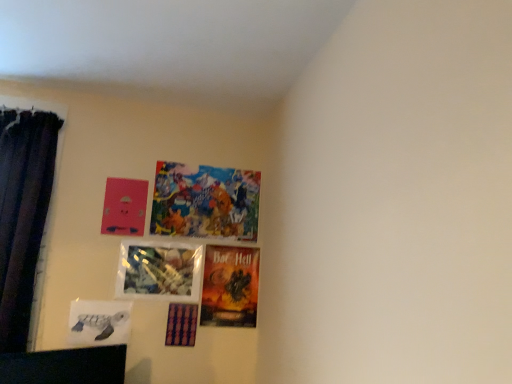
In order to click on dark velvet curtain at left in this screenshot , I will do `click(23, 214)`.

You are a GUI agent. You are given a task and a screenshot of the screen. Output one action in this format:
    pyautogui.click(x=<x>, y=<y>)
    Task: Click on the colorful paper collage at upper center, positioned as the first picture frame in top-to-bottom order
    The height and width of the screenshot is (384, 512).
    Given the screenshot: What is the action you would take?
    click(205, 202)

Between colorful paper collage at upper center, positioned as the first picture frame in top-to-bottom order, and matte cardboard poster at center, which is the 4th picture frame in top-to-bottom order, which one has less height?

colorful paper collage at upper center, positioned as the first picture frame in top-to-bottom order.

From the image's perspective, relative to matte cardboard poster at center, which is the 4th picture frame in top-to-bottom order, is colorful paper collage at upper center, positioned as the first picture frame in top-to-bottom order, above or below?

Clearly, from the image's perspective, colorful paper collage at upper center, positioned as the first picture frame in top-to-bottom order, is above matte cardboard poster at center, which is the 4th picture frame in top-to-bottom order.

Would you say matte cardboard poster at center, which is the 4th picture frame in top-to-bottom order, is part of colorful paper collage at upper center, which ranks as the 6th picture frame in bottom-to-top order,'s contents?

No, matte cardboard poster at center, which is the 4th picture frame in top-to-bottom order, is not surrounded by colorful paper collage at upper center, which ranks as the 6th picture frame in bottom-to-top order.

From the image's perspective, is translucent plastic picture frame at center, the 3th picture frame viewed from the top, positioned above or below matte cardboard poster at center, positioned as the 3th picture frame in bottom-to-top order?

translucent plastic picture frame at center, the 3th picture frame viewed from the top, is situated higher than matte cardboard poster at center, positioned as the 3th picture frame in bottom-to-top order, in the image.

Consider the image. From a real-world perspective, is translucent plastic picture frame at center, arranged as the 4th picture frame when ordered from the bottom, below matte cardboard poster at center, positioned as the 3th picture frame in bottom-to-top order?

No, from a real-world perspective, translucent plastic picture frame at center, arranged as the 4th picture frame when ordered from the bottom, is not beneath matte cardboard poster at center, positioned as the 3th picture frame in bottom-to-top order.

Considering the sizes of objects translucent plastic picture frame at center, the 3th picture frame viewed from the top, and matte cardboard poster at center, which is the 4th picture frame in top-to-bottom order, in the image provided, who is taller, translucent plastic picture frame at center, the 3th picture frame viewed from the top, or matte cardboard poster at center, which is the 4th picture frame in top-to-bottom order,?

matte cardboard poster at center, which is the 4th picture frame in top-to-bottom order.

Measure the distance from purple glossy picture frame at lower center, which is the 1th picture frame in bottom-to-top order, to translucent plastic picture frame at center, the 3th picture frame viewed from the top.

The distance of purple glossy picture frame at lower center, which is the 1th picture frame in bottom-to-top order, from translucent plastic picture frame at center, the 3th picture frame viewed from the top, is 7.83 inches.

Is purple glossy picture frame at lower center, which is the 1th picture frame in bottom-to-top order, touching translucent plastic picture frame at center, the 3th picture frame viewed from the top?

No, purple glossy picture frame at lower center, which is the 1th picture frame in bottom-to-top order, is not in contact with translucent plastic picture frame at center, the 3th picture frame viewed from the top.

Which of these two, purple glossy picture frame at lower center, which is counted as the 6th picture frame, starting from the top, or translucent plastic picture frame at center, arranged as the 4th picture frame when ordered from the bottom, stands shorter?

purple glossy picture frame at lower center, which is counted as the 6th picture frame, starting from the top, is shorter.

Is purple glossy picture frame at lower center, which is counted as the 6th picture frame, starting from the top, wider or thinner than translucent plastic picture frame at center, arranged as the 4th picture frame when ordered from the bottom?

In the image, purple glossy picture frame at lower center, which is counted as the 6th picture frame, starting from the top, appears to be wider than translucent plastic picture frame at center, arranged as the 4th picture frame when ordered from the bottom.

Considering the relative positions of matte cardboard poster at center, positioned as the 3th picture frame in bottom-to-top order, and matte pink picture frame at upper left, acting as the second picture frame starting from the top, in the image provided, is matte cardboard poster at center, positioned as the 3th picture frame in bottom-to-top order, to the left or to the right of matte pink picture frame at upper left, acting as the second picture frame starting from the top,?

matte cardboard poster at center, positioned as the 3th picture frame in bottom-to-top order, is to the right of matte pink picture frame at upper left, acting as the second picture frame starting from the top.

I want to click on the 2nd picture frame positioned above the matte cardboard poster at center, which is the 4th picture frame in top-to-bottom order (from the image's perspective), so click(x=124, y=207).

Is matte cardboard poster at center, positioned as the 3th picture frame in bottom-to-top order, positioned with its back to matte pink picture frame at upper left, placed as the fifth picture frame when sorted from bottom to top?

matte cardboard poster at center, positioned as the 3th picture frame in bottom-to-top order, is not turned away from matte pink picture frame at upper left, placed as the fifth picture frame when sorted from bottom to top.

Is colorful paper collage at upper center, positioned as the first picture frame in top-to-bottom order, in front of translucent plastic picture frame at center, the 3th picture frame viewed from the top?

No, colorful paper collage at upper center, positioned as the first picture frame in top-to-bottom order, is further to the viewer.

Does colorful paper collage at upper center, positioned as the first picture frame in top-to-bottom order, turn towards translucent plastic picture frame at center, arranged as the 4th picture frame when ordered from the bottom?

No, colorful paper collage at upper center, positioned as the first picture frame in top-to-bottom order, is not turned towards translucent plastic picture frame at center, arranged as the 4th picture frame when ordered from the bottom.

Is colorful paper collage at upper center, positioned as the first picture frame in top-to-bottom order, outside of translucent plastic picture frame at center, the 3th picture frame viewed from the top?

Indeed, colorful paper collage at upper center, positioned as the first picture frame in top-to-bottom order, is completely outside translucent plastic picture frame at center, the 3th picture frame viewed from the top.

How different are the orientations of colorful paper collage at upper center, which ranks as the 6th picture frame in bottom-to-top order, and translucent plastic picture frame at center, arranged as the 4th picture frame when ordered from the bottom, in degrees?

colorful paper collage at upper center, which ranks as the 6th picture frame in bottom-to-top order, and translucent plastic picture frame at center, arranged as the 4th picture frame when ordered from the bottom, are facing 0.026 degrees away from each other.

Considering the positions of point (209, 247) and point (186, 327), is point (209, 247) closer or farther from the camera than point (186, 327)?

Point (209, 247).

Looking at this image, is matte cardboard poster at center, positioned as the 3th picture frame in bottom-to-top order, positioned with its back to purple glossy picture frame at lower center, which is the 1th picture frame in bottom-to-top order?

No, matte cardboard poster at center, positioned as the 3th picture frame in bottom-to-top order, is not facing the opposite direction of purple glossy picture frame at lower center, which is the 1th picture frame in bottom-to-top order.

Starting from the matte cardboard poster at center, which is the 4th picture frame in top-to-bottom order, which picture frame is the 2nd one to the left? Please provide its 2D coordinates.

[(181, 324)]

Is colorful paper collage at upper center, which ranks as the 6th picture frame in bottom-to-top order, inside the boundaries of purple glossy picture frame at lower center, which is the 1th picture frame in bottom-to-top order, or outside?

colorful paper collage at upper center, which ranks as the 6th picture frame in bottom-to-top order, lies outside purple glossy picture frame at lower center, which is the 1th picture frame in bottom-to-top order.

Which is more to the left, colorful paper collage at upper center, positioned as the first picture frame in top-to-bottom order, or purple glossy picture frame at lower center, which is counted as the 6th picture frame, starting from the top?

purple glossy picture frame at lower center, which is counted as the 6th picture frame, starting from the top.

Who is shorter, colorful paper collage at upper center, positioned as the first picture frame in top-to-bottom order, or purple glossy picture frame at lower center, which is the 1th picture frame in bottom-to-top order?

Standing shorter between the two is purple glossy picture frame at lower center, which is the 1th picture frame in bottom-to-top order.

At what (x,y) coordinates should I click in order to perform the action: click on picture frame on the right side of colorful paper collage at upper center, which ranks as the 6th picture frame in bottom-to-top order. Please return your answer as a coordinate pair (x, y). Looking at the image, I should click on (230, 286).

Where is `picture frame that is the 1st one when counting upward from the matte cardboard poster at center, positioned as the 3th picture frame in bottom-to-top order (from the image's perspective)`? picture frame that is the 1st one when counting upward from the matte cardboard poster at center, positioned as the 3th picture frame in bottom-to-top order (from the image's perspective) is located at coordinates (159, 271).

Looking at the image, which one is located closer to translucent plastic picture frame at center, the 3th picture frame viewed from the top, colorful paper collage at upper center, which ranks as the 6th picture frame in bottom-to-top order, or dark velvet curtain at left?

Among the two, colorful paper collage at upper center, which ranks as the 6th picture frame in bottom-to-top order, is located nearer to translucent plastic picture frame at center, the 3th picture frame viewed from the top.

Looking at the image, which one is located further to matte cardboard poster at center, which is the 4th picture frame in top-to-bottom order, matte white turtle at lower left, which ranks as the second picture frame in bottom-to-top order, or dark velvet curtain at left?

dark velvet curtain at left lies further to matte cardboard poster at center, which is the 4th picture frame in top-to-bottom order, than the other object.

From the picture: Looking at the image, which one is located further to dark velvet curtain at left, matte white turtle at lower left, which ranks as the second picture frame in bottom-to-top order, or matte cardboard poster at center, positioned as the 3th picture frame in bottom-to-top order?

Based on the image, matte cardboard poster at center, positioned as the 3th picture frame in bottom-to-top order, appears to be further to dark velvet curtain at left.

Considering their positions, is matte cardboard poster at center, positioned as the 3th picture frame in bottom-to-top order, positioned closer to dark velvet curtain at left than matte pink picture frame at upper left, placed as the fifth picture frame when sorted from bottom to top?

matte pink picture frame at upper left, placed as the fifth picture frame when sorted from bottom to top, lies closer to dark velvet curtain at left than the other object.

Estimate the real-world distances between objects in this image. Which object is further from purple glossy picture frame at lower center, which is the 1th picture frame in bottom-to-top order, matte pink picture frame at upper left, acting as the second picture frame starting from the top, or matte cardboard poster at center, which is the 4th picture frame in top-to-bottom order?

matte pink picture frame at upper left, acting as the second picture frame starting from the top, is positioned further to the anchor purple glossy picture frame at lower center, which is the 1th picture frame in bottom-to-top order.

Which object lies nearer to the anchor point matte cardboard poster at center, positioned as the 3th picture frame in bottom-to-top order, translucent plastic picture frame at center, the 3th picture frame viewed from the top, or dark velvet curtain at left?

translucent plastic picture frame at center, the 3th picture frame viewed from the top.

When comparing their distances from translucent plastic picture frame at center, arranged as the 4th picture frame when ordered from the bottom, does matte white turtle at lower left, positioned as the fifth picture frame in top-to-bottom order, or dark velvet curtain at left seem further?

dark velvet curtain at left is positioned further to the anchor translucent plastic picture frame at center, arranged as the 4th picture frame when ordered from the bottom.

Estimate the real-world distances between objects in this image. Which object is further from dark velvet curtain at left, colorful paper collage at upper center, positioned as the first picture frame in top-to-bottom order, or purple glossy picture frame at lower center, which is counted as the 6th picture frame, starting from the top?

Based on the image, purple glossy picture frame at lower center, which is counted as the 6th picture frame, starting from the top, appears to be further to dark velvet curtain at left.

Where is `curtain between matte pink picture frame at upper left, placed as the fifth picture frame when sorted from bottom to top, and matte white turtle at lower left, positioned as the fifth picture frame in top-to-bottom order, vertically`? Image resolution: width=512 pixels, height=384 pixels. curtain between matte pink picture frame at upper left, placed as the fifth picture frame when sorted from bottom to top, and matte white turtle at lower left, positioned as the fifth picture frame in top-to-bottom order, vertically is located at coordinates (23, 214).